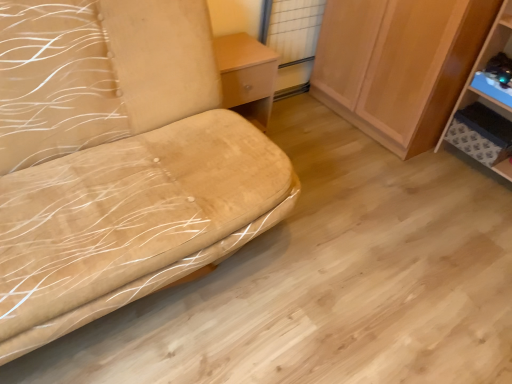
Question: Is wooden cabinet at right not close to light wood/texture table at center?

Choices:
 (A) no
 (B) yes

Answer: (A)

Question: Does wooden cabinet at right contain light wood/texture table at center?

Choices:
 (A) yes
 (B) no

Answer: (B)

Question: Is wooden cabinet at right taller than light wood/texture table at center?

Choices:
 (A) yes
 (B) no

Answer: (A)

Question: Would you say wooden cabinet at right is outside light wood/texture table at center?

Choices:
 (A) yes
 (B) no

Answer: (A)

Question: From a real-world perspective, is wooden cabinet at right on top of light wood/texture table at center?

Choices:
 (A) yes
 (B) no

Answer: (A)

Question: From the image's perspective, is wooden cabinet at right on light wood/texture table at center?

Choices:
 (A) yes
 (B) no

Answer: (A)

Question: From the image's perspective, would you say light wood/texture table at center is positioned over blue plastic shelf at right?

Choices:
 (A) no
 (B) yes

Answer: (B)

Question: Can you confirm if light wood/texture table at center is positioned to the right of blue plastic shelf at right?

Choices:
 (A) no
 (B) yes

Answer: (A)

Question: Does light wood/texture table at center turn towards blue plastic shelf at right?

Choices:
 (A) yes
 (B) no

Answer: (B)

Question: Is light wood/texture table at center not close to blue plastic shelf at right?

Choices:
 (A) no
 (B) yes

Answer: (B)

Question: Does light wood/texture table at center come behind blue plastic shelf at right?

Choices:
 (A) yes
 (B) no

Answer: (A)

Question: Is light wood/texture table at center positioned with its back to blue plastic shelf at right?

Choices:
 (A) yes
 (B) no

Answer: (B)

Question: From a real-world perspective, is suede-like beige sofa at left beneath blue plastic shelf at right?

Choices:
 (A) yes
 (B) no

Answer: (B)